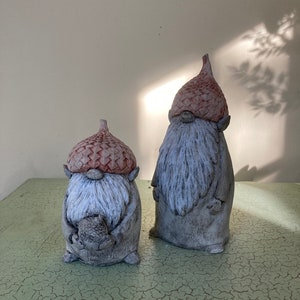
You are a GUI agent. You are given a task and a screenshot of the screen. Output one action in this format:
    pyautogui.click(x=<x>, y=<y>)
    Task: Click on the white wall
    The image size is (300, 300).
    Given the screenshot: What is the action you would take?
    pyautogui.click(x=78, y=66)